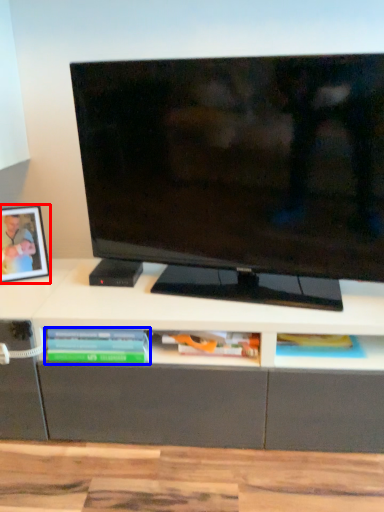
Question: Which object appears farthest to the camera in this image, picture frame (highlighted by a red box) or book (highlighted by a blue box)?

Choices:
 (A) picture frame
 (B) book

Answer: (A)